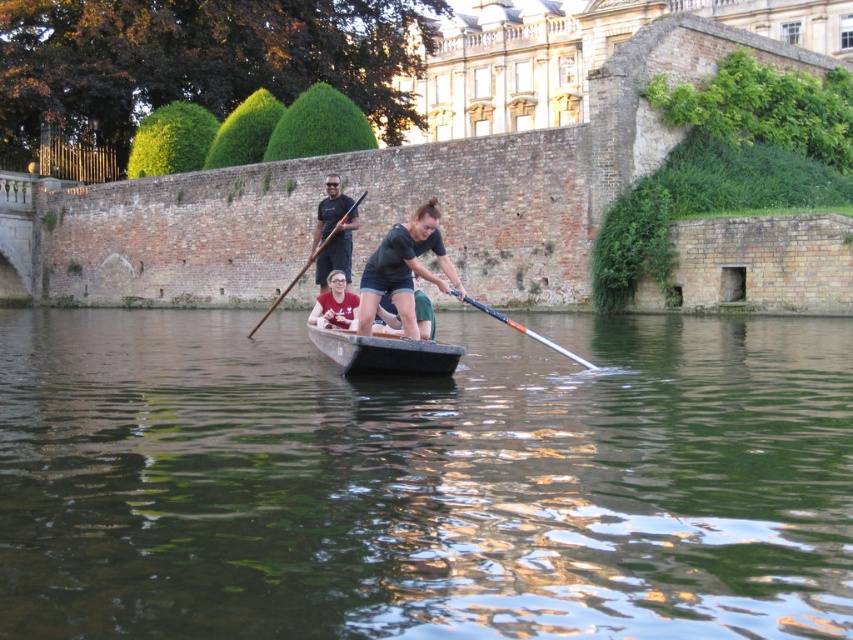
Is point (335, 305) in front of point (252, 332)?

Yes, point (335, 305) is closer to viewer.

Locate an element on the screen. matte red shirt at center is located at coordinates (335, 305).

Is the position of dark blue fabric shirt at center more distant than that of matte black paddle at upper center?

No, it is in front of matte black paddle at upper center.

Is dark blue fabric shirt at center positioned before matte black paddle at upper center?

Yes, dark blue fabric shirt at center is closer to the viewer.

Between point (387, 240) and point (347, 284), which one is positioned behind?

Point (347, 284)

The image size is (853, 640). Find the location of `dark blue fabric shirt at center`. dark blue fabric shirt at center is located at coordinates (403, 268).

Can you confirm if black plastic canoe at center is bigger than matte red shirt at center?

Incorrect, black plastic canoe at center is not larger than matte red shirt at center.

Is black plastic canoe at center wider than matte red shirt at center?

Indeed, black plastic canoe at center has a greater width compared to matte red shirt at center.

The width and height of the screenshot is (853, 640). In order to click on black plastic canoe at center in this screenshot , I will do `click(386, 353)`.